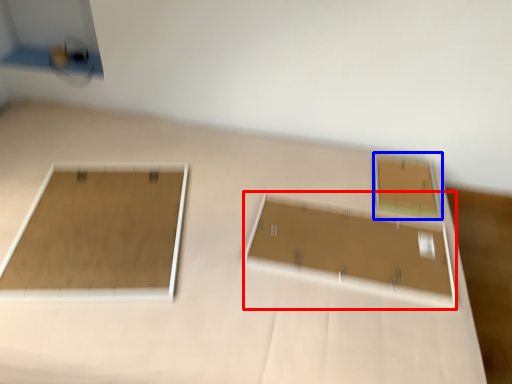
Question: Which of the following is the farthest to the observer, rectangle (highlighted by a red box) or rectangle (highlighted by a blue box)?

Choices:
 (A) rectangle
 (B) rectangle

Answer: (B)